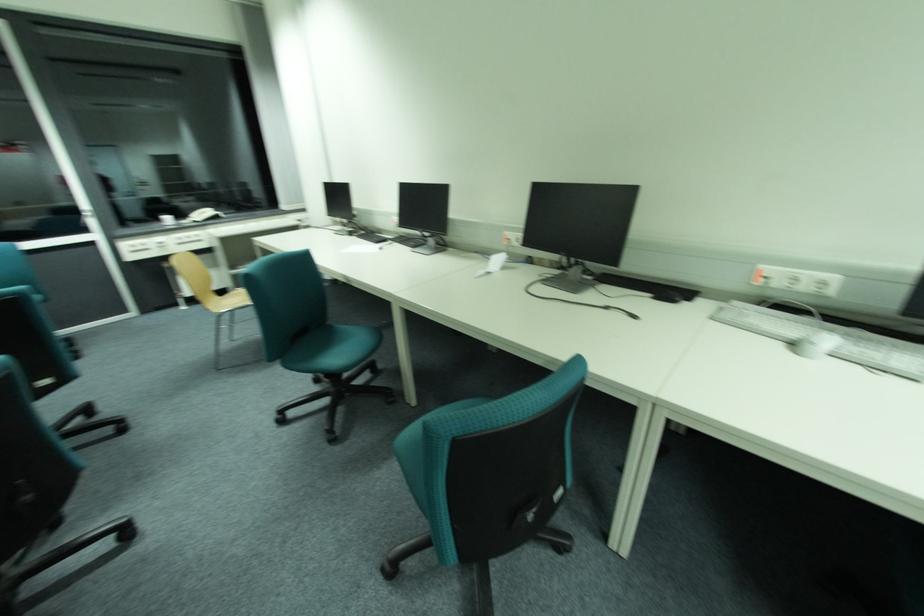
Image resolution: width=924 pixels, height=616 pixels. What do you see at coordinates (829, 338) in the screenshot?
I see `a white keyboard` at bounding box center [829, 338].